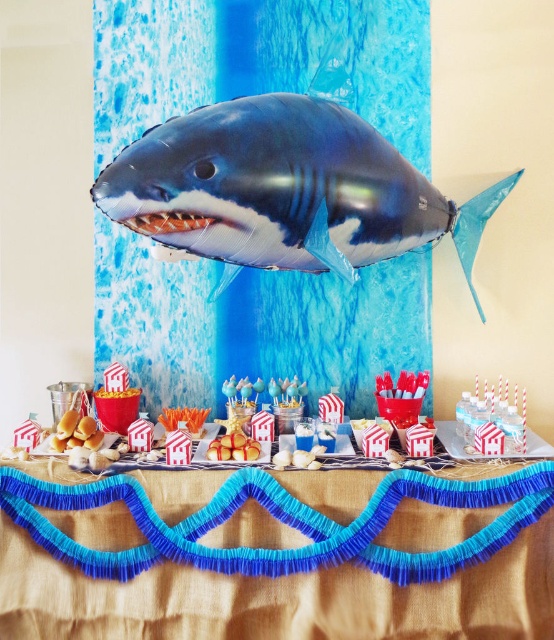
You are a guest at the party and want to take a photo with the shiny metallic shark at upper center and the white paper houses at center. Which object will appear closer to the camera in the photo?

The shiny metallic shark at upper center will appear closer to the camera in the photo because it is positioned in front of the white paper houses at center.

You are a guest at the party and want to place a seashell decoration between the blue paper garland at center and the white paper houses at center. Based on their positions, which object should the seashell be closer to?

The blue paper garland at center is positioned on the left side of white paper houses at center, so the seashell should be placed closer to the blue paper garland at center to maintain the left alignment.

You are a guest at the party and want to take a photo of the shiny metallic shark at upper center without any obstructions. Since you can only move around the table, will you be able to position yourself in a way to capture it clearly without the blue paper garland at center blocking the view?

The shiny metallic shark at upper center is behind the blue paper garland at center, so you can move around the table to find an angle where the blue paper garland at center is not blocking the view of the shiny metallic shark at upper center.